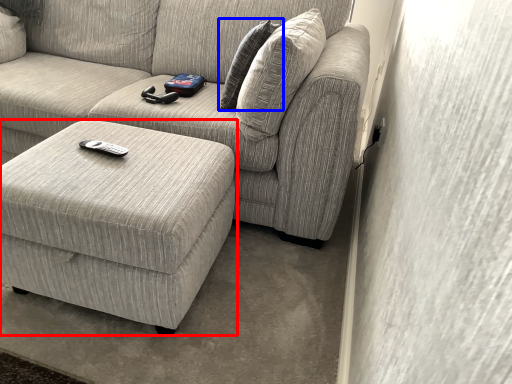
Question: Which object is closer to the camera taking this photo, table (highlighted by a red box) or pillow (highlighted by a blue box)?

Choices:
 (A) table
 (B) pillow

Answer: (A)